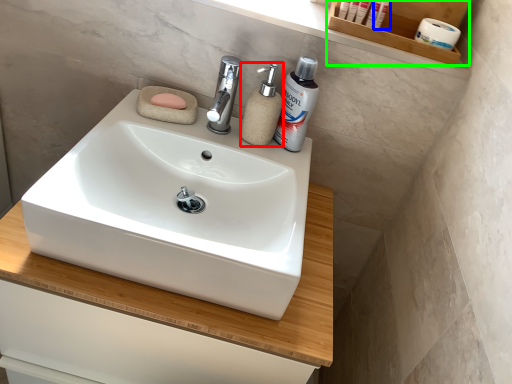
Question: Considering the real-world distances, which object is closest to soap dispenser (highlighted by a red box)? cosmetic (highlighted by a blue box) or shelf (highlighted by a green box).

Choices:
 (A) cosmetic
 (B) shelf

Answer: (B)